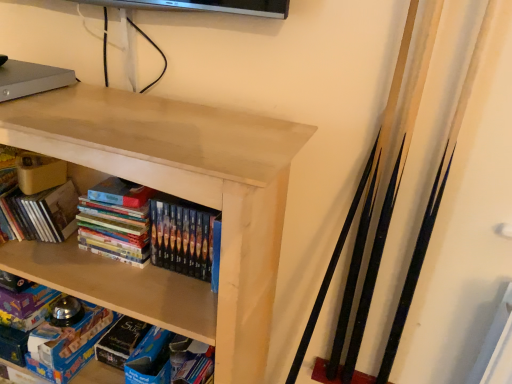
Question: Which is correct: matte cardboard book at upper left, which appears as the 2th book when viewed from the right, is inside matte wood shelf at upper center, or outside of it?

Choices:
 (A) outside
 (B) inside

Answer: (B)

Question: Does point (18, 210) appear closer or farther from the camera than point (267, 284)?

Choices:
 (A) farther
 (B) closer

Answer: (A)

Question: Which object is the farthest from the multicolored glossy books at center, positioned as the 2th book in left-to-right order?

Choices:
 (A) matte wood shelf at upper center
 (B) blue matte board game at lower left
 (C) matte cardboard book at upper left, which appears as the 2th book when viewed from the right

Answer: (B)

Question: Considering the real-world distances, which object is closest to the multicolored glossy books at center, positioned as the 2th book in left-to-right order?

Choices:
 (A) matte wood shelf at upper center
 (B) blue matte board game at lower left
 (C) matte cardboard book at upper left, which is the first book in left-to-right order

Answer: (C)